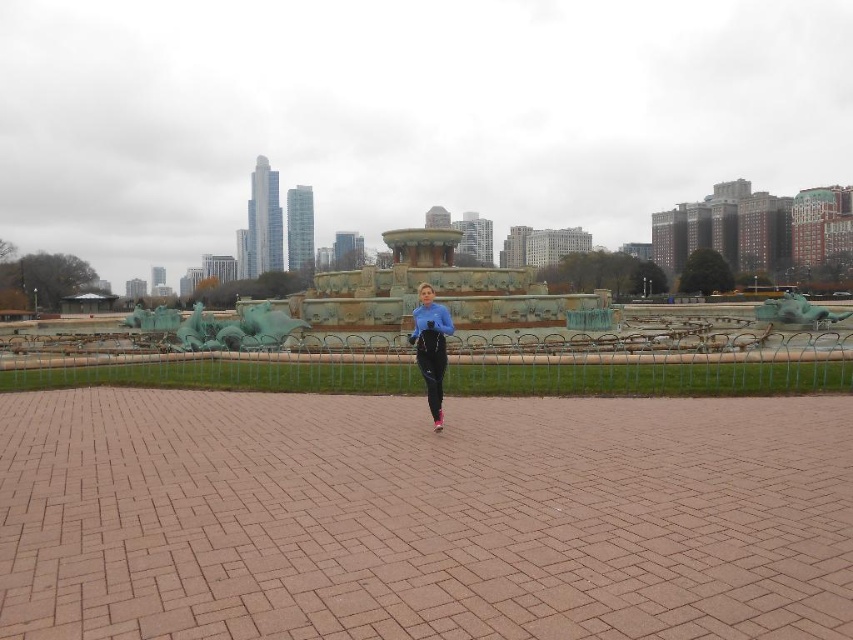
From the picture: You are a photographer standing at the Buckingham Fountain in Chicago. You want to capture a photo of the brown brick path at center and the blue fabric pants at center. Which object is closer to the camera?

The blue fabric pants at center are closer to the camera because they have a greater height than the brown brick path at center, indicating they are nearer in the scene.

You are standing at the point with coordinates (422, 516) in the Buckingham Fountain area. What is the object located at that point?

The object located at point (422, 516) is the brown brick path at center.